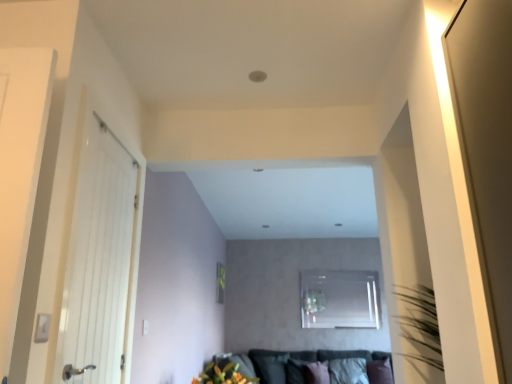
Question: From a real-world perspective, is transparent glass window at center below white fabric pillow at lower center, which appears as the second pillow when viewed from the left?

Choices:
 (A) no
 (B) yes

Answer: (A)

Question: Does transparent glass window at center have a greater height compared to white fabric pillow at lower center, which appears as the second pillow when viewed from the left?

Choices:
 (A) no
 (B) yes

Answer: (B)

Question: From the image's perspective, is transparent glass window at center above white fabric pillow at lower center, which is counted as the second pillow, starting from the right?

Choices:
 (A) yes
 (B) no

Answer: (A)

Question: From a real-world perspective, is transparent glass window at center located higher than white fabric pillow at lower center, which appears as the second pillow when viewed from the left?

Choices:
 (A) no
 (B) yes

Answer: (B)

Question: Does transparent glass window at center turn towards white fabric pillow at lower center, which is counted as the second pillow, starting from the right?

Choices:
 (A) no
 (B) yes

Answer: (A)

Question: In terms of height, does velvet dark grey couch at lower center look taller or shorter compared to vibrant orange flowers at lower center?

Choices:
 (A) short
 (B) tall

Answer: (B)

Question: Does point (356, 367) appear closer or farther from the camera than point (208, 367)?

Choices:
 (A) farther
 (B) closer

Answer: (A)

Question: Is velvet dark grey couch at lower center in front of or behind vibrant orange flowers at lower center in the image?

Choices:
 (A) behind
 (B) front

Answer: (A)

Question: Is velvet dark grey couch at lower center wider or thinner than vibrant orange flowers at lower center?

Choices:
 (A) wide
 (B) thin

Answer: (A)

Question: From the image's perspective, is transparent glass window at center located above or below black fabric pillow at lower center, arranged as the 3th pillow when viewed from the right?

Choices:
 (A) below
 (B) above

Answer: (B)

Question: In the image, is transparent glass window at center on the left side or the right side of black fabric pillow at lower center, arranged as the 3th pillow when viewed from the right?

Choices:
 (A) right
 (B) left

Answer: (A)

Question: From a real-world perspective, is transparent glass window at center physically located above or below black fabric pillow at lower center, arranged as the 3th pillow when viewed from the right?

Choices:
 (A) above
 (B) below

Answer: (A)

Question: Is transparent glass window at center inside the boundaries of black fabric pillow at lower center, which is the first pillow in left-to-right order, or outside?

Choices:
 (A) outside
 (B) inside

Answer: (A)

Question: From a real-world perspective, relative to black fabric pillow at lower center, which is the first pillow in left-to-right order, is white wooden door at left vertically above or below?

Choices:
 (A) below
 (B) above

Answer: (B)

Question: Considering the positions of white wooden door at left and black fabric pillow at lower center, which is the first pillow in left-to-right order, in the image, is white wooden door at left wider or thinner than black fabric pillow at lower center, which is the first pillow in left-to-right order,?

Choices:
 (A) wide
 (B) thin

Answer: (B)